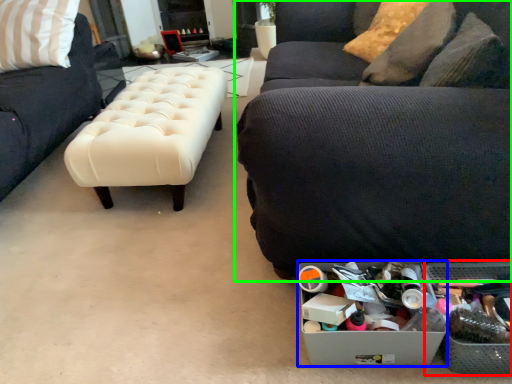
Question: Based on their relative distances, which object is farther from storage box (highlighted by a red box)? Choose from storage box (highlighted by a blue box) and studio couch (highlighted by a green box).

Choices:
 (A) storage box
 (B) studio couch

Answer: (B)